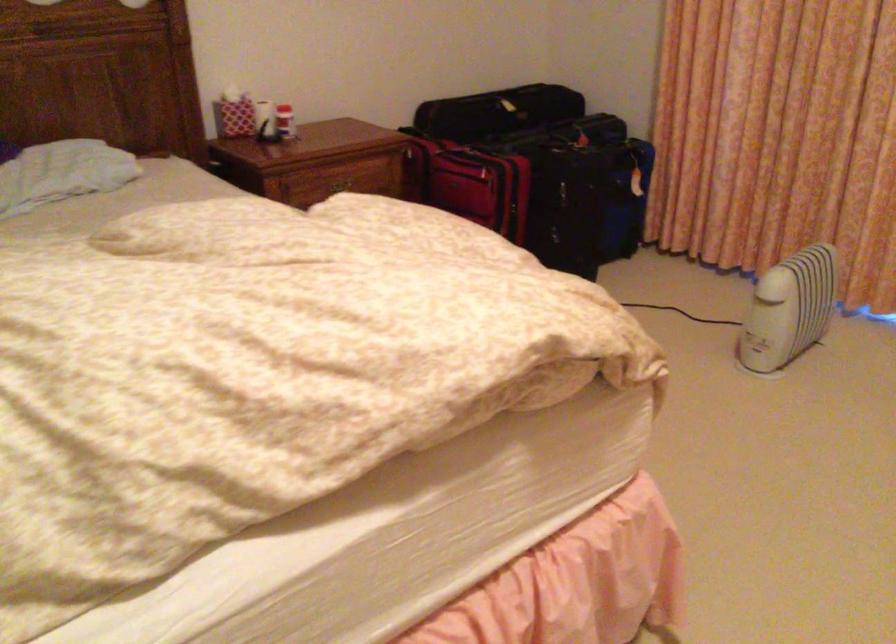
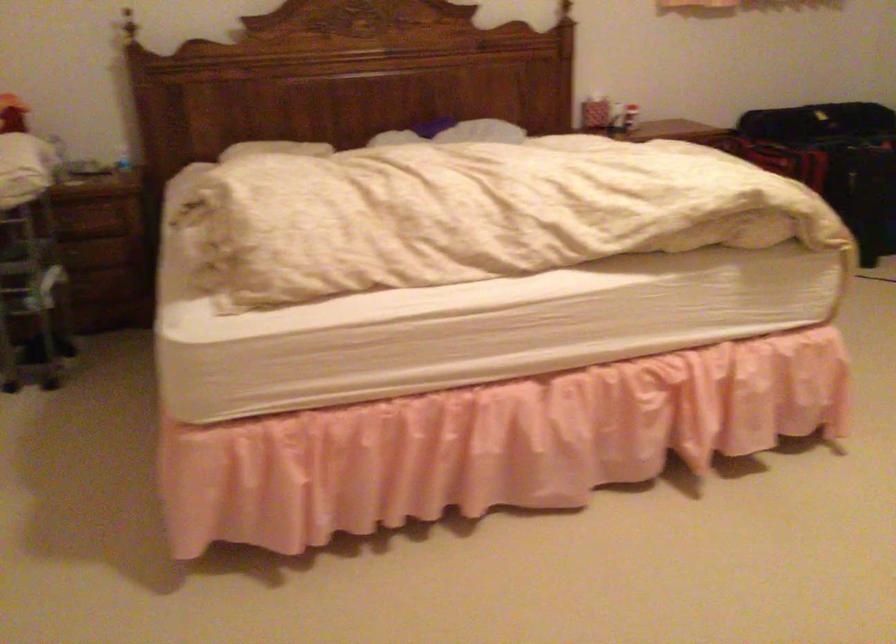
Question: In a continuous first-person perspective shot, in which direction is the camera moving?

Choices:
 (A) Left
 (B) Right
 (C) Forward
 (D) Backward

Answer: (D)